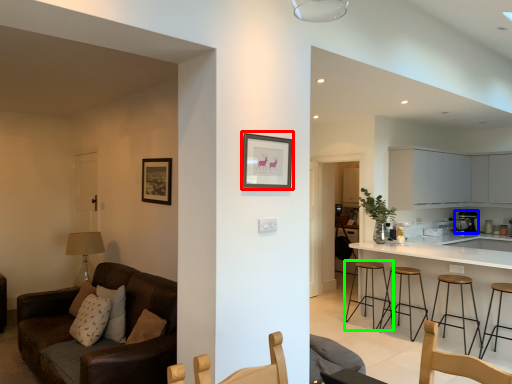
Question: Which object is the closest to the picture frame (highlighted by a red box)? Choose among these: appliance (highlighted by a blue box) or stool (highlighted by a green box).

Choices:
 (A) appliance
 (B) stool

Answer: (B)